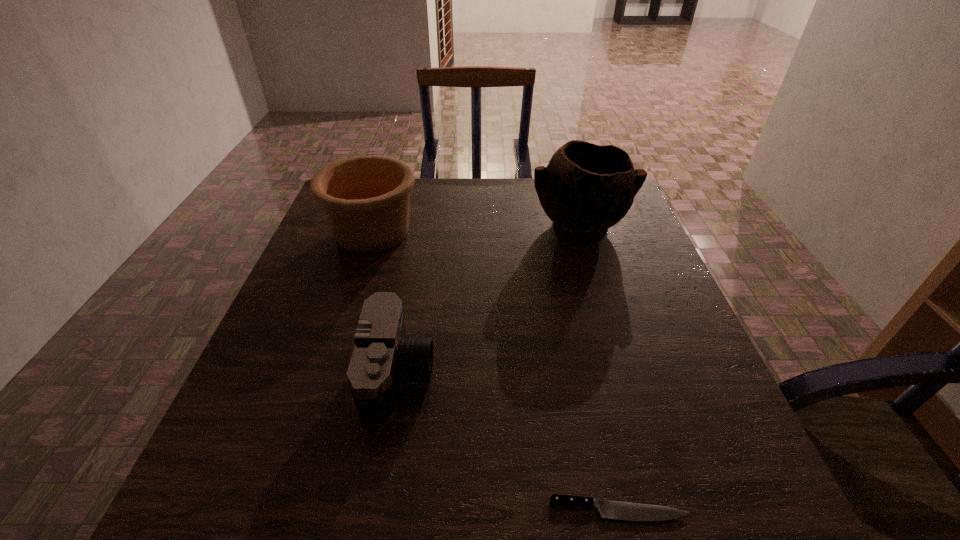
Find the location of a particular element. the taller pottery is located at coordinates (585, 189).

At what (x,y) coordinates should I click in order to perform the action: click on the right pottery. Please return your answer as a coordinate pair (x, y). Looking at the image, I should click on (585, 189).

Find the location of a particular element. This screenshot has height=540, width=960. the left pottery is located at coordinates (365, 199).

This screenshot has width=960, height=540. I want to click on the shorter pottery, so click(x=365, y=199).

Find the location of a particular element. This screenshot has width=960, height=540. the third tallest object is located at coordinates (383, 358).

Find the location of a particular element. This screenshot has width=960, height=540. camera is located at coordinates (383, 358).

Where is `the shortest object`? The width and height of the screenshot is (960, 540). the shortest object is located at coordinates click(x=615, y=510).

Find the location of a particular element. the nearest object is located at coordinates (615, 510).

The width and height of the screenshot is (960, 540). In order to click on vacant area situated on the front of the tallest object in this screenshot , I will do pyautogui.click(x=616, y=346).

Locate an element on the screen. vacant space located on the right of the second tallest object is located at coordinates (468, 233).